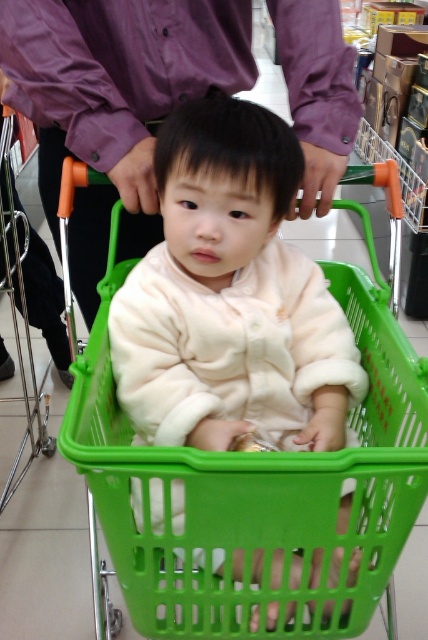
You are a store employee who needs to ensure safety. The soft beige baby at center and the purple cotton shirt at upper center are in a shopping basket. Which object is taller and requires more space?

The soft beige baby at center is taller than the purple cotton shirt at upper center, so it requires more space.

You are a store employee who needs to ensure the safety of the soft beige baby at center in the shopping cart. Based on the coordinates provided, is the baby positioned centrally within the basket?

The soft beige baby at center is located at point coordinates, which indicates it is positioned centrally within the basket.

You are a parent trying to find your child in a crowded store. You remember that your child is in a bright green shopping basket and wearing a light pink long sleeved outfit. You see a point marked at coordinates (231,298) in the image. What is at that point?

The point at coordinates (231,298) marks the location of the soft beige baby at center.